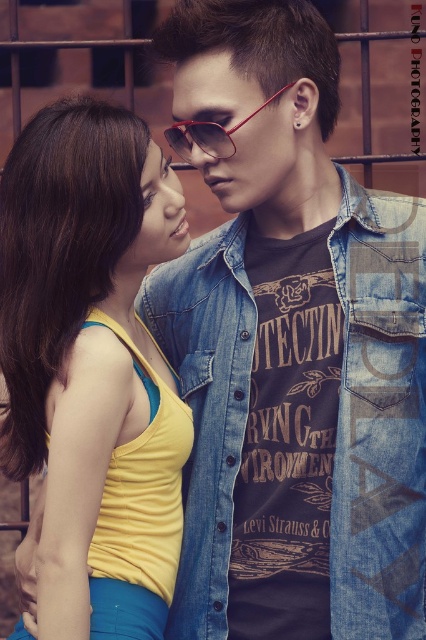
In the scene shown: Does yellow fabric tank top at left have a greater width compared to shiny red sunglasses at center?

Yes, yellow fabric tank top at left is wider than shiny red sunglasses at center.

Does point (46, 232) lie behind point (167, 140)?

No, it is in front of (167, 140).

Image resolution: width=426 pixels, height=640 pixels. Describe the element at coordinates (92, 365) in the screenshot. I see `yellow fabric tank top at left` at that location.

Locate an element on the screen. The width and height of the screenshot is (426, 640). yellow fabric tank top at left is located at coordinates (92, 365).

Which is behind, point (143, 422) or point (152, 301)?

Positioned behind is point (152, 301).

Is the position of yellow fabric tank top at left less distant than that of denim jacket at center?

Yes, yellow fabric tank top at left is closer to the viewer.

The height and width of the screenshot is (640, 426). In order to click on yellow fabric tank top at left in this screenshot , I will do `click(92, 365)`.

Based on the photo, measure the distance between denim jacket at center and camera.

denim jacket at center is 4.09 meters from camera.

Does denim jacket at center appear on the left side of shiny red sunglasses at center?

In fact, denim jacket at center is to the right of shiny red sunglasses at center.

You are a GUI agent. You are given a task and a screenshot of the screen. Output one action in this format:
    pyautogui.click(x=<x>, y=<y>)
    Task: Click on the denim jacket at center
    The image size is (426, 640).
    Given the screenshot: What is the action you would take?
    pyautogui.click(x=379, y=417)